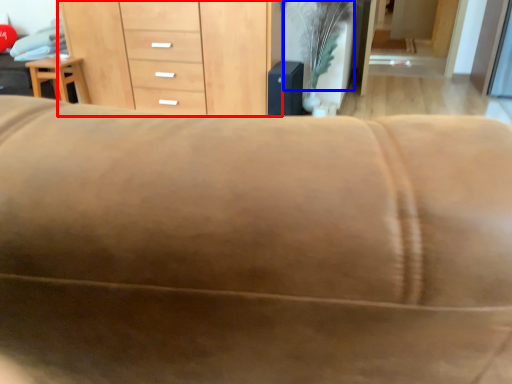
Question: Which of the following is the farthest to the observer, chest of drawers (highlighted by a red box) or plant (highlighted by a blue box)?

Choices:
 (A) chest of drawers
 (B) plant

Answer: (A)